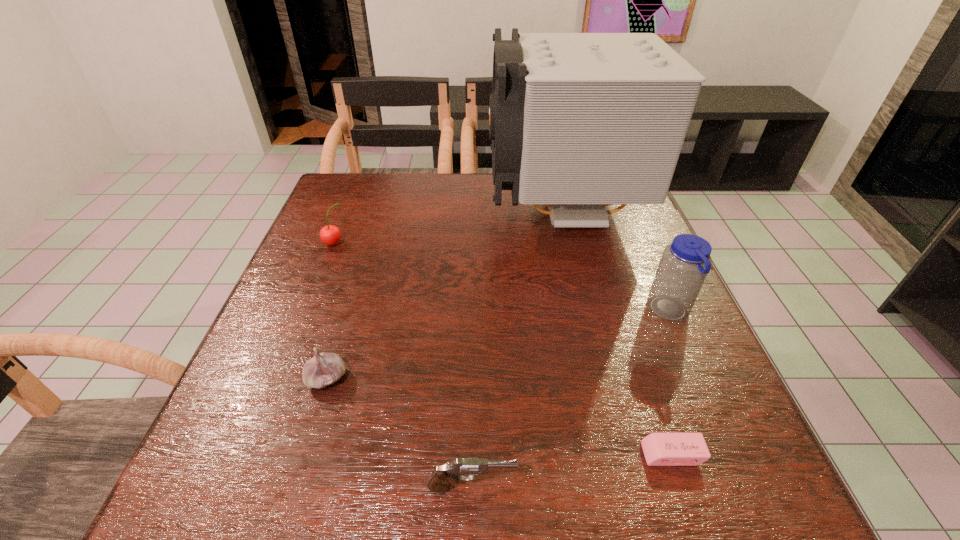
This screenshot has width=960, height=540. In order to click on the tallest object in this screenshot , I will do `click(578, 121)`.

I want to click on the fifth shortest object, so click(684, 265).

Where is `the fourth nearest object`? the fourth nearest object is located at coordinates (684, 265).

Where is `cherry`? The height and width of the screenshot is (540, 960). cherry is located at coordinates (330, 234).

I want to click on the leftmost object, so click(330, 234).

At what (x,y) coordinates should I click in order to perform the action: click on garlic. Please return your answer as a coordinate pair (x, y). The image size is (960, 540). Looking at the image, I should click on (324, 369).

I want to click on the third nearest object, so click(x=324, y=369).

I want to click on pistol, so click(x=440, y=480).

Where is `the shortest object`? The width and height of the screenshot is (960, 540). the shortest object is located at coordinates (660, 449).

The image size is (960, 540). I want to click on the second nearest object, so click(x=660, y=449).